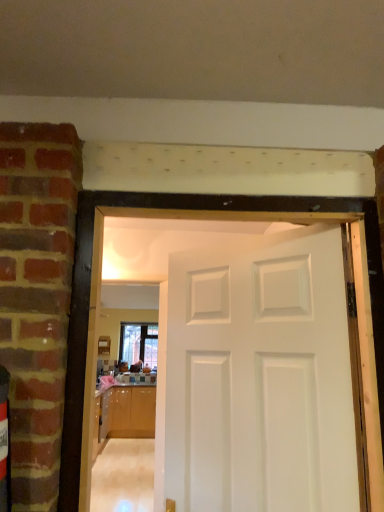
Question: Is glossy wood cabinetry at lower left completely or partially outside of clear glass window at center?

Choices:
 (A) no
 (B) yes

Answer: (B)

Question: From the image's perspective, is glossy wood cabinetry at lower left located above clear glass window at center?

Choices:
 (A) no
 (B) yes

Answer: (A)

Question: Does glossy wood cabinetry at lower left have a lesser height compared to clear glass window at center?

Choices:
 (A) no
 (B) yes

Answer: (A)

Question: Are glossy wood cabinetry at lower left and clear glass window at center beside each other?

Choices:
 (A) no
 (B) yes

Answer: (A)

Question: Considering the relative sizes of glossy wood cabinetry at lower left and clear glass window at center in the image provided, is glossy wood cabinetry at lower left thinner than clear glass window at center?

Choices:
 (A) yes
 (B) no

Answer: (B)

Question: Which is correct: glossy wood cabinetry at lower left is inside clear glass window at center, or outside of it?

Choices:
 (A) inside
 (B) outside

Answer: (B)

Question: From the image's perspective, is glossy wood cabinetry at lower left located above or below clear glass window at center?

Choices:
 (A) below
 (B) above

Answer: (A)

Question: Is glossy wood cabinetry at lower left wider or thinner than clear glass window at center?

Choices:
 (A) wide
 (B) thin

Answer: (A)

Question: From a real-world perspective, is glossy wood cabinetry at lower left physically located above or below clear glass window at center?

Choices:
 (A) above
 (B) below

Answer: (B)

Question: Looking at the image, does white painted wood door at center seem bigger or smaller compared to glossy wood cabinetry at lower left?

Choices:
 (A) small
 (B) big

Answer: (A)

Question: Considering their positions, is white painted wood door at center located in front of or behind glossy wood cabinetry at lower left?

Choices:
 (A) behind
 (B) front

Answer: (B)

Question: Considering the positions of point 185,457 and point 139,425, is point 185,457 closer or farther from the camera than point 139,425?

Choices:
 (A) closer
 (B) farther

Answer: (A)

Question: From a real-world perspective, is white painted wood door at center positioned above or below glossy wood cabinetry at lower left?

Choices:
 (A) below
 (B) above

Answer: (B)

Question: From a real-world perspective, is clear glass window at center physically located above or below glossy wood cabinetry at lower left?

Choices:
 (A) below
 (B) above

Answer: (B)

Question: In terms of height, does clear glass window at center look taller or shorter compared to glossy wood cabinetry at lower left?

Choices:
 (A) tall
 (B) short

Answer: (B)